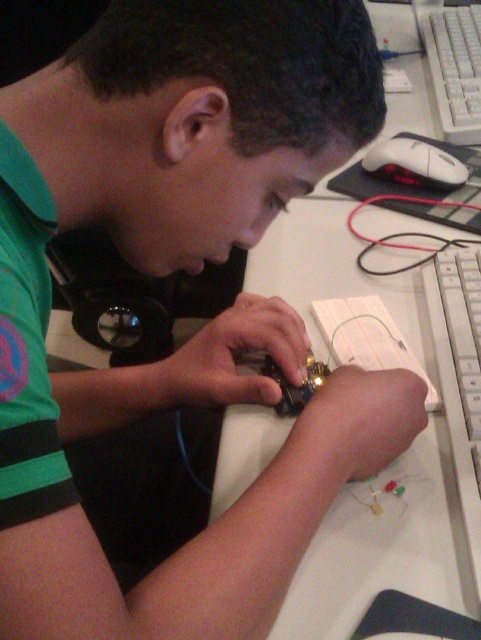
You are setting up a workstation and need to place a new monitor between the white plastic keyboard at right and the white plastic keyboard at upper right. Given that the monitor requires 70 centimeters of space, will there be enough room?

The distance between the white plastic keyboard at right and the white plastic keyboard at upper right is 69.17 centimeters. Since the monitor requires 70 centimeters, there is insufficient space to place the monitor between them.

You are a delivery robot that needs to place a small package between the white plastic keyboard at upper right and the mouse. How far apart are these two items?

The white plastic keyboard at upper right and the mouse are 3.74 feet apart.